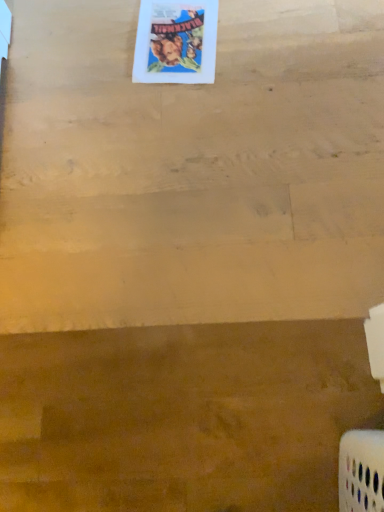
Find the location of a particular element. free location above matte paper comic book at upper center (from a real-world perspective) is located at coordinates (175, 34).